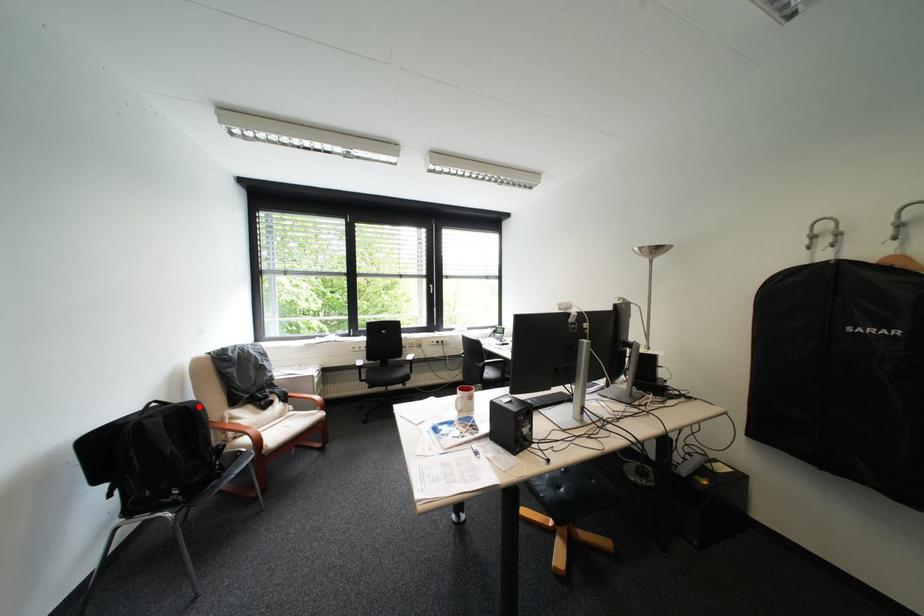
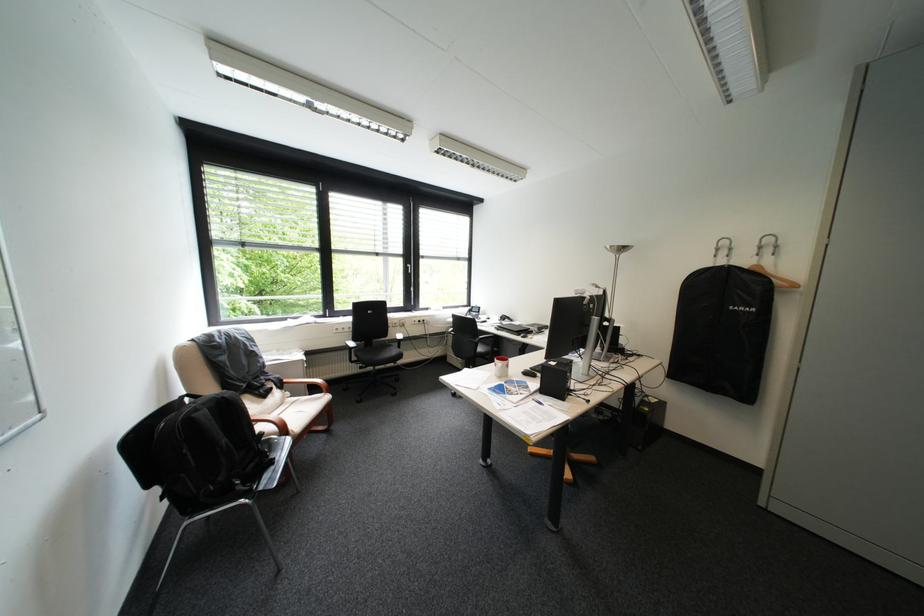
Question: I am providing you with two images of the same scene from different viewpoints. A red point is shown in image1. For the corresponding object point in image2, is it positioned nearer or farther from the camera?

Choices:
 (A) Nearer
 (B) Farther

Answer: (A)